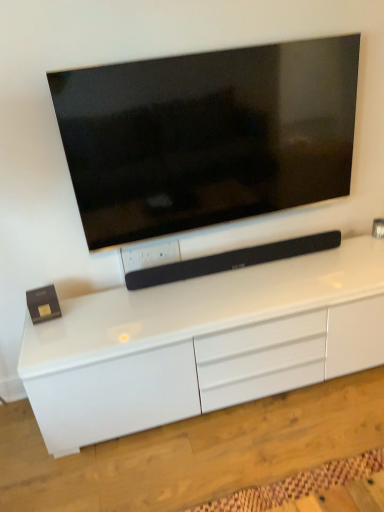
Locate an element on the screen. This screenshot has width=384, height=512. space that is in front of black matte soundbar at center is located at coordinates (220, 292).